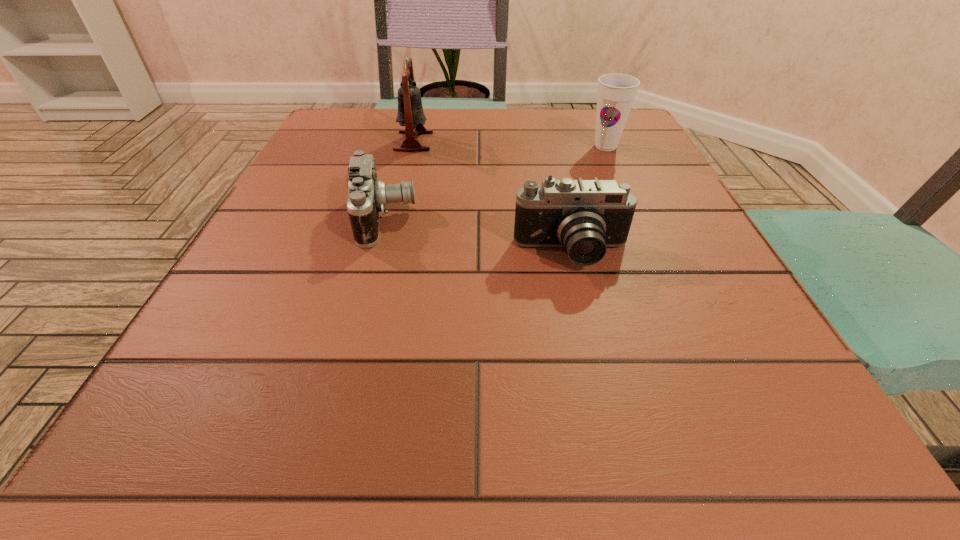
Identify which object is located as the third nearest to the second tallest object. Please provide its 2D coordinates. Your answer should be formatted as a tuple, i.e. [(x, y)], where the tuple contains the x and y coordinates of a point satisfying the conditions above.

[(367, 196)]

Select which object appears as the third closest to the tallest object. Please provide its 2D coordinates. Your answer should be formatted as a tuple, i.e. [(x, y)], where the tuple contains the x and y coordinates of a point satisfying the conditions above.

[(616, 92)]